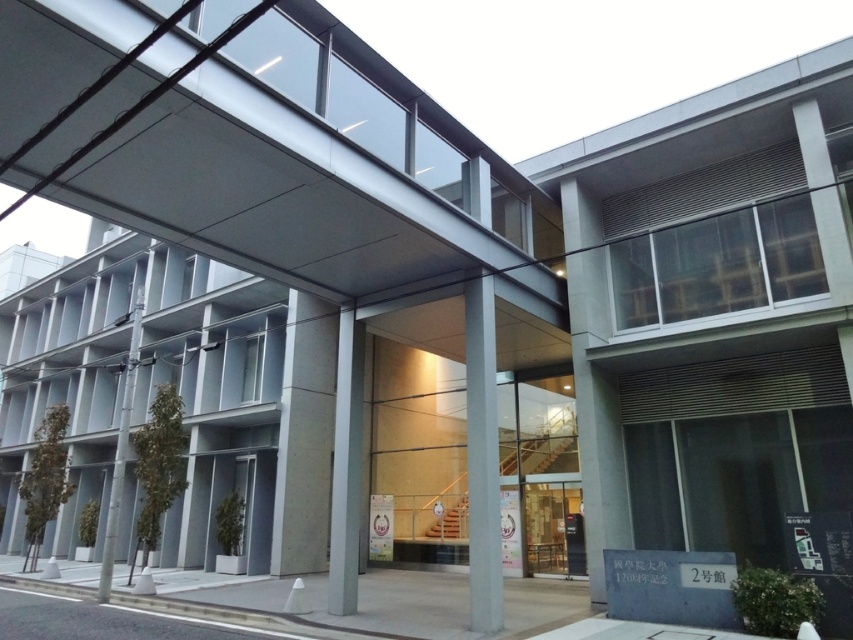
You are an architect evaluating the structural integrity of the building. You notice two pillars supporting the entrance area. Which pillar, the sleek concrete pillar at center or the smooth concrete pillar at center, is taller and might provide better support for the upper floors?

The sleek concrete pillar at center has a greater height compared to the smooth concrete pillar at center, so it might provide better support for the upper floors.